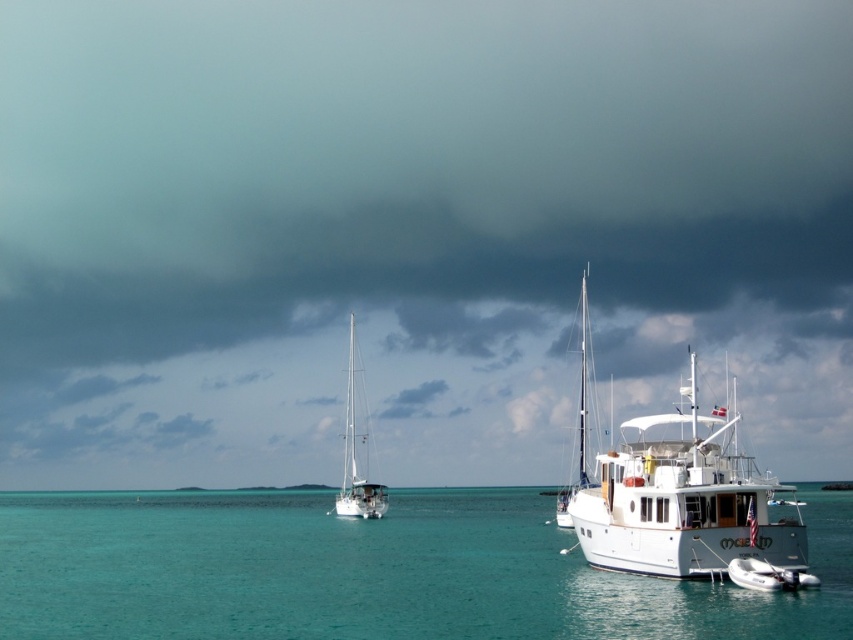
You are a photographer standing on the shore of this maritime scene. You want to capture a photo that includes both the white matte boat at lower right and the white glossy sailboat at right. Which boat should you position closer to the front of your photo frame to ensure both are visible?

You should position the white matte boat at lower right closer to the front of your photo frame since it is closer to the viewer than the white glossy sailboat at right, ensuring both are visible in the composition.

You are a photographer planning to capture a shot of the white matte boat at lower right and the white glossy sailboat at center. Since both are white, you want to ensure they are distinguishable in your photo. Which boat should you position to the left to create a clear visual separation?

The white glossy sailboat at center should be positioned to the left of the white matte boat at lower right to create clear visual separation, as the white matte boat at lower right is already to the right of the white glossy sailboat at center.